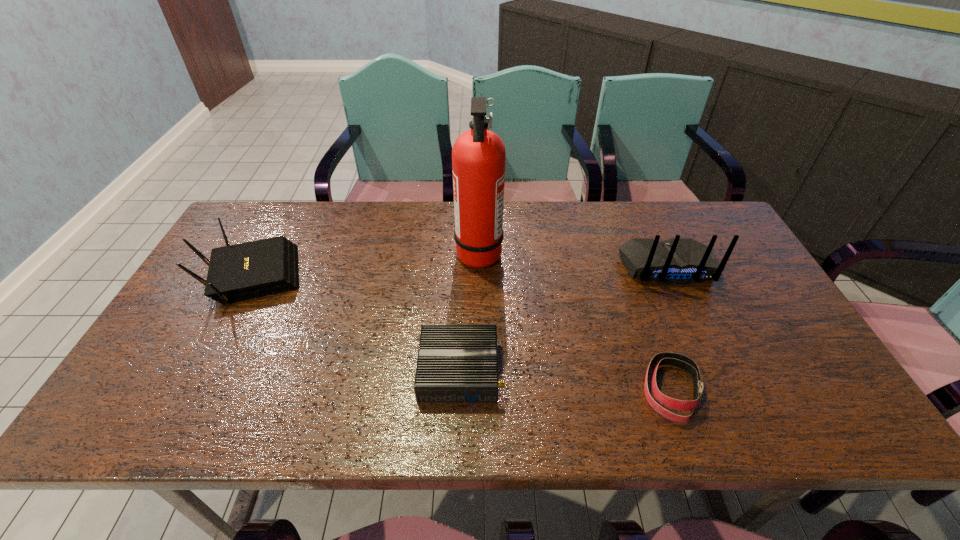
Locate an element on the screen. fire extinguisher is located at coordinates (478, 155).

This screenshot has width=960, height=540. Identify the location of the fourth shortest object. (677, 261).

This screenshot has height=540, width=960. I want to click on the rightmost router, so click(677, 261).

The width and height of the screenshot is (960, 540). In order to click on the second tallest router in this screenshot , I will do [x=244, y=271].

Identify the location of the third shortest object. (244, 271).

Image resolution: width=960 pixels, height=540 pixels. Find the location of `the nearest router`. the nearest router is located at coordinates (456, 362).

Find the location of a particular element. Image resolution: width=960 pixels, height=540 pixels. the shortest router is located at coordinates (456, 362).

Where is `dog collar`? The height and width of the screenshot is (540, 960). dog collar is located at coordinates (683, 362).

At what (x,y) coordinates should I click in order to perform the action: click on vacant space positioned on the handle side of the tallest object. Please return your answer as a coordinate pair (x, y). Image resolution: width=960 pixels, height=540 pixels. Looking at the image, I should click on (532, 252).

You are a GUI agent. You are given a task and a screenshot of the screen. Output one action in this format:
    pyautogui.click(x=<x>, y=<y>)
    Task: Click on the free spot located on the back of the rightmost router
    
    Given the screenshot: What is the action you would take?
    pyautogui.click(x=731, y=409)